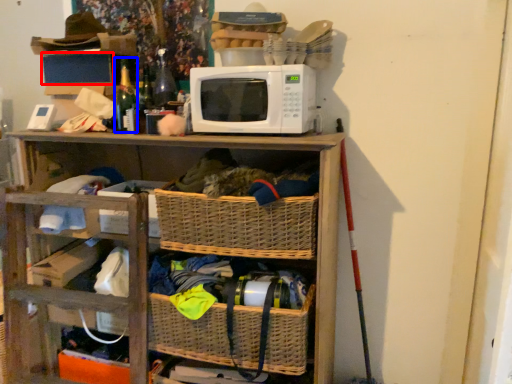
Question: Which of the following is the closest to the observer, storage box (highlighted by a red box) or bottle (highlighted by a blue box)?

Choices:
 (A) storage box
 (B) bottle

Answer: (B)